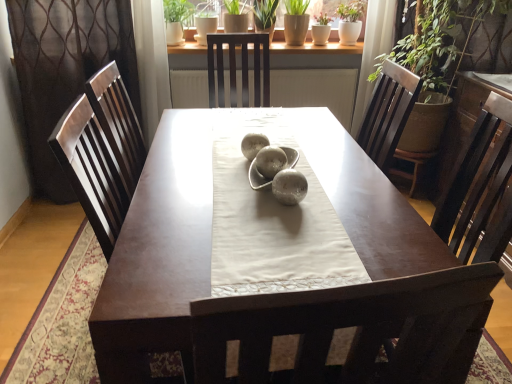
What is the approximate width of matte brown table at center?

5.24 feet.

Locate an element on the screen. green matte plant at upper center, which appears as the first plant when viewed from the right is located at coordinates (265, 13).

Locate an element on the screen. The image size is (512, 384). brown textured curtain at left is located at coordinates (65, 69).

Are brown textured curtain at left and green matte pot at upper center, marked as the 2th plant in a left-to-right arrangement, beside each other?

No, brown textured curtain at left is not with green matte pot at upper center, marked as the 2th plant in a left-to-right arrangement.

From the image's perspective, which one is positioned higher, brown textured curtain at left or green matte pot at upper center, marked as the 2th plant in a left-to-right arrangement?

green matte pot at upper center, marked as the 2th plant in a left-to-right arrangement, is shown above in the image.

Considering the relative sizes of brown textured curtain at left and green matte pot at upper center, which ranks as the 2th plant in right-to-left order, in the image provided, is brown textured curtain at left smaller than green matte pot at upper center, which ranks as the 2th plant in right-to-left order,?

Incorrect, brown textured curtain at left is not smaller in size than green matte pot at upper center, which ranks as the 2th plant in right-to-left order.

The width and height of the screenshot is (512, 384). I want to click on table on the right of green matte pot at upper center, marked as the 2th plant in a left-to-right arrangement, so click(x=158, y=252).

From the image's perspective, is green matte pot at upper center, which ranks as the 2th plant in right-to-left order, above matte brown table at center?

Yes, from the image's perspective, green matte pot at upper center, which ranks as the 2th plant in right-to-left order, is on top of matte brown table at center.

In the scene shown: Measure the distance from green matte pot at upper center, marked as the 2th plant in a left-to-right arrangement, to matte brown table at center.

A distance of 2.03 meters exists between green matte pot at upper center, marked as the 2th plant in a left-to-right arrangement, and matte brown table at center.

From a real-world perspective, which is physically above, green matte pot at upper center, marked as the 2th plant in a left-to-right arrangement, or matte brown table at center?

green matte pot at upper center, marked as the 2th plant in a left-to-right arrangement, from a real-world perspective.

Can you tell me how much matte brown table at center and green matte pot at upper center, marked as the 2th plant in a left-to-right arrangement, differ in facing direction?

There is a 2.09-degree angle between the facing directions of matte brown table at center and green matte pot at upper center, marked as the 2th plant in a left-to-right arrangement.

Considering the relative sizes of matte brown table at center and green matte pot at upper center, which ranks as the 2th plant in right-to-left order, in the image provided, is matte brown table at center shorter than green matte pot at upper center, which ranks as the 2th plant in right-to-left order,?

Incorrect, the height of matte brown table at center does not fall short of that of green matte pot at upper center, which ranks as the 2th plant in right-to-left order.

Does matte brown table at center turn towards green matte pot at upper center, marked as the 2th plant in a left-to-right arrangement?

No, matte brown table at center is not turned towards green matte pot at upper center, marked as the 2th plant in a left-to-right arrangement.

Relative to green matte pot at upper center, which ranks as the 2th plant in right-to-left order, is matte brown table at center in front or behind?

matte brown table at center is positioned closer to the viewer than green matte pot at upper center, which ranks as the 2th plant in right-to-left order.

Is matte brown table at center positioned before green matte plant at upper center, which appears as the first plant when viewed from the right?

Yes.

Is matte brown table at center oriented towards green matte plant at upper center, which is the third plant in left-to-right order?

No, matte brown table at center does not turn towards green matte plant at upper center, which is the third plant in left-to-right order.

Considering the relative sizes of matte brown table at center and green matte plant at upper center, which appears as the first plant when viewed from the right, in the image provided, is matte brown table at center bigger than green matte plant at upper center, which appears as the first plant when viewed from the right,?

Correct, matte brown table at center is larger in size than green matte plant at upper center, which appears as the first plant when viewed from the right.

How distant is matte brown table at center from green matte plant at upper center, which appears as the first plant when viewed from the right?

matte brown table at center and green matte plant at upper center, which appears as the first plant when viewed from the right, are 1.94 meters apart.

Which is behind, point (180, 19) or point (163, 155)?

Point (180, 19)

Is green matte plant at upper center, which ranks as the third plant in right-to-left order, not close to matte brown table at center?

Absolutely, green matte plant at upper center, which ranks as the third plant in right-to-left order, is distant from matte brown table at center.

This screenshot has height=384, width=512. I want to click on table in front of the green matte plant at upper center, the first plant viewed from the left, so click(x=158, y=252).

From a real-world perspective, which object stands above the other?

green matte plant at upper center, the first plant viewed from the left, is physically above.

Considering the relative sizes of green matte plant at upper center, which appears as the first plant when viewed from the right, and matte brown table at center in the image provided, is green matte plant at upper center, which appears as the first plant when viewed from the right, wider than matte brown table at center?

No, green matte plant at upper center, which appears as the first plant when viewed from the right, is not wider than matte brown table at center.

Considering the points (264, 4) and (144, 230), which point is behind, point (264, 4) or point (144, 230)?

The point (264, 4) is farther.

From a real-world perspective, which object stands above the other?

green matte plant at upper center, which appears as the first plant when viewed from the right.

From a real-world perspective, relative to green matte plant at upper center, which appears as the first plant when viewed from the right, is brown textured curtain at left vertically above or below?

brown textured curtain at left is below green matte plant at upper center, which appears as the first plant when viewed from the right.

How far apart are brown textured curtain at left and green matte plant at upper center, which is the third plant in left-to-right order?

4.25 feet.

You are a GUI agent. You are given a task and a screenshot of the screen. Output one action in this format:
    pyautogui.click(x=<x>, y=<y>)
    Task: Click on the curtain that is under the green matte plant at upper center, which appears as the first plant when viewed from the right (from a real-world perspective)
    
    Given the screenshot: What is the action you would take?
    pyautogui.click(x=65, y=69)

Which object is further away from the camera taking this photo, brown textured curtain at left or green matte plant at upper center, which appears as the first plant when viewed from the right?

green matte plant at upper center, which appears as the first plant when viewed from the right, is behind.

The width and height of the screenshot is (512, 384). In order to click on plant that is the 2nd one when counting backward from the brown textured curtain at left in this screenshot , I will do `click(234, 6)`.

Where is `table in front of the green matte pot at upper center, which ranks as the 2th plant in right-to-left order`? table in front of the green matte pot at upper center, which ranks as the 2th plant in right-to-left order is located at coordinates (158, 252).

Looking at the image, which one is located closer to green matte pot at upper center, which ranks as the 2th plant in right-to-left order, green matte plant at upper center, which is the third plant in left-to-right order, or matte brown table at center?

green matte plant at upper center, which is the third plant in left-to-right order, is positioned closer to the anchor green matte pot at upper center, which ranks as the 2th plant in right-to-left order.

Based on their spatial positions, is brown textured curtain at left or green matte plant at upper center, the first plant viewed from the left, closer to matte brown table at center?

brown textured curtain at left is closer to matte brown table at center.

Which object lies nearer to the anchor point matte brown table at center, green matte pot at upper center, which ranks as the 2th plant in right-to-left order, or green matte plant at upper center, the first plant viewed from the left?

green matte plant at upper center, the first plant viewed from the left, lies closer to matte brown table at center than the other object.

Based on their spatial positions, is green matte plant at upper center, which appears as the first plant when viewed from the right, or matte brown table at center further from green matte plant at upper center, the first plant viewed from the left?

matte brown table at center.

When comparing their distances from green matte plant at upper center, the first plant viewed from the left, does green matte pot at upper center, which ranks as the 2th plant in right-to-left order, or brown textured curtain at left seem further?

brown textured curtain at left lies further to green matte plant at upper center, the first plant viewed from the left, than the other object.

Considering their positions, is brown textured curtain at left positioned closer to green matte pot at upper center, marked as the 2th plant in a left-to-right arrangement, than matte brown table at center?

brown textured curtain at left is positioned closer to the anchor green matte pot at upper center, marked as the 2th plant in a left-to-right arrangement.

Considering their positions, is green matte pot at upper center, marked as the 2th plant in a left-to-right arrangement, positioned further to green matte plant at upper center, which ranks as the third plant in right-to-left order, than green matte plant at upper center, which is the third plant in left-to-right order?

green matte plant at upper center, which is the third plant in left-to-right order, is positioned further to the anchor green matte plant at upper center, which ranks as the third plant in right-to-left order.

From the image, which object appears to be farther from green matte plant at upper center, the first plant viewed from the left, matte brown table at center or brown textured curtain at left?

matte brown table at center.

Where is `plant located between green matte plant at upper center, the first plant viewed from the left, and green matte plant at upper center, which is the third plant in left-to-right order, in the left-right direction`? The image size is (512, 384). plant located between green matte plant at upper center, the first plant viewed from the left, and green matte plant at upper center, which is the third plant in left-to-right order, in the left-right direction is located at coordinates (234, 6).

Image resolution: width=512 pixels, height=384 pixels. What are the coordinates of `plant between brown textured curtain at left and green matte pot at upper center, marked as the 2th plant in a left-to-right arrangement` in the screenshot? It's located at (177, 10).

The image size is (512, 384). I want to click on plant between matte brown table at center and green matte pot at upper center, which ranks as the 2th plant in right-to-left order, along the z-axis, so click(x=177, y=10).

Find the location of a particular element. This screenshot has height=384, width=512. curtain between matte brown table at center and green matte plant at upper center, which ranks as the third plant in right-to-left order, from front to back is located at coordinates (65, 69).